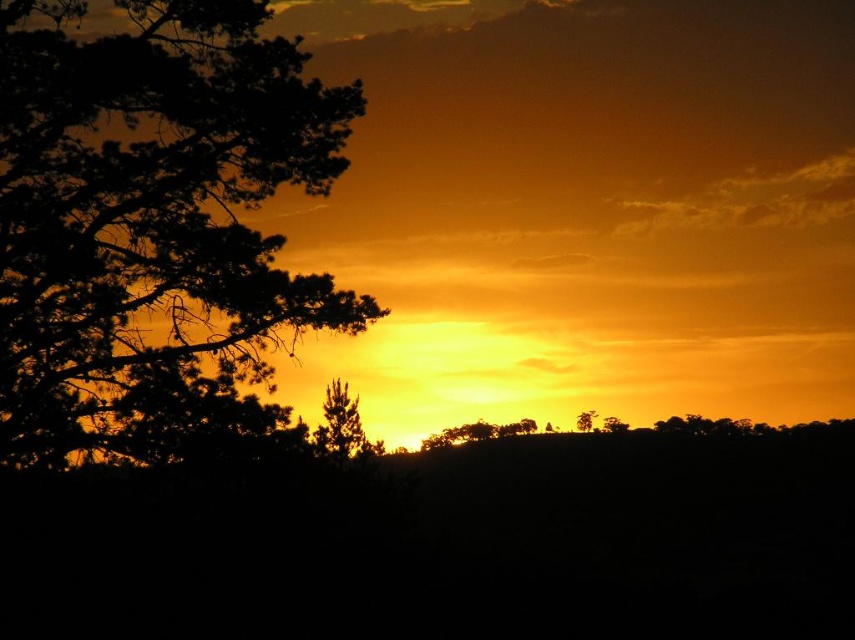
You are standing in the scene and want to take a photo of the green textured pine tree at center. Considering the distance, will you need to use a zoom lens to capture the tree clearly from your current position?

The green textured pine tree at center is 36.13 meters away from the viewer. Since this distance is quite far, using a zoom lens would help capture the tree clearly without needing to move closer.

You are standing at the center of the image and want to walk towards the silhouette bark tree at left. In which direction should you head?

You should head to the left since the silhouette bark tree at left is located at point (x=150, y=220), which is to the left of the center.

You are an artist trying to paint the sunset scene. You notice two trees in the image. The silhouette bark tree at left and the green matte tree at center. Which tree should you paint first if you want to paint the wider tree first?

The silhouette bark tree at left might be wider than green matte tree at center, so you should paint the silhouette bark tree at left first.